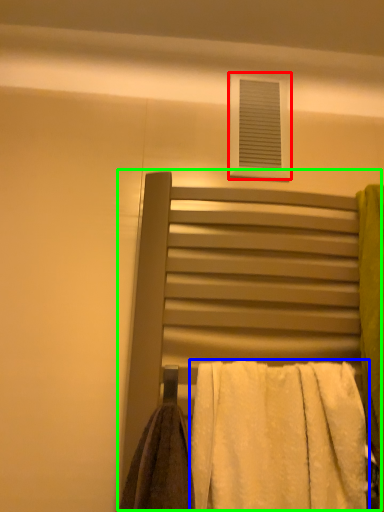
Question: Which is farther away from window (highlighted by a red box)? towel (highlighted by a blue box) or bed (highlighted by a green box)?

Choices:
 (A) towel
 (B) bed

Answer: (A)